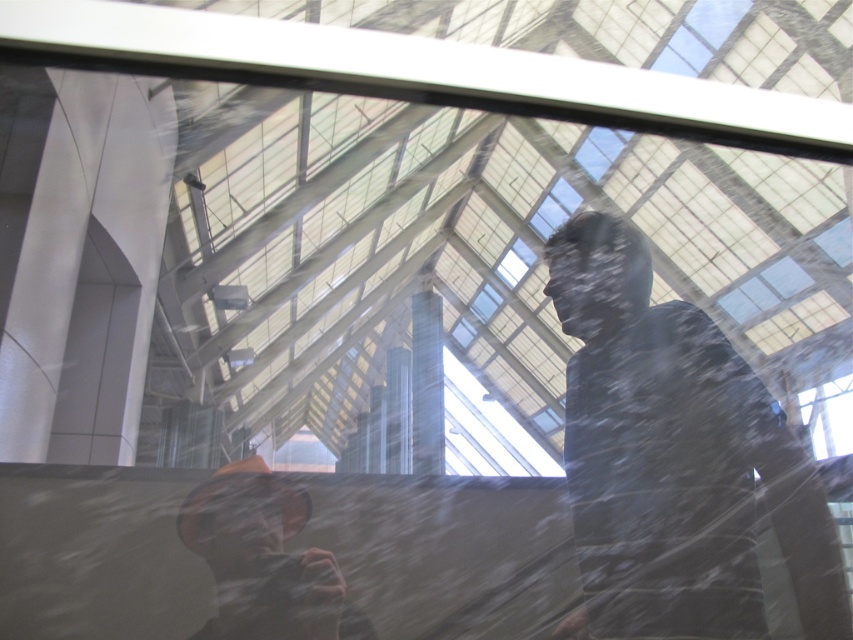
You are looking through a glass surface that has some distortion and reflections. You notice two points marked on the glass at coordinates point (575, 540) and point (595, 173). Based on their positions, which point is closer to you?

Point (575, 540) is closer to the viewer than point (595, 173).

You are holding a 1.5 meter long pole and need to place it horizontally on the floor behind the matte black jacket at right. Can you fit the pole without it overlapping the jacket?

The matte black jacket at right is 1.23 meters away from the camera. Since the pole is 1.5 meters long, placing it horizontally behind the jacket would require at least 1.5 meters of space. However, the jacket is only 1.23 meters away, so the pole might extend beyond the available space and overlap the jacket. Therefore, it may not fit without overlapping.

You are standing in a room with a glass surface ahead. On the glass, there is a point marked at coordinates (x=260, y=557). What object is located at that point?

The orange fabric hat at lower left is located at point (x=260, y=557).